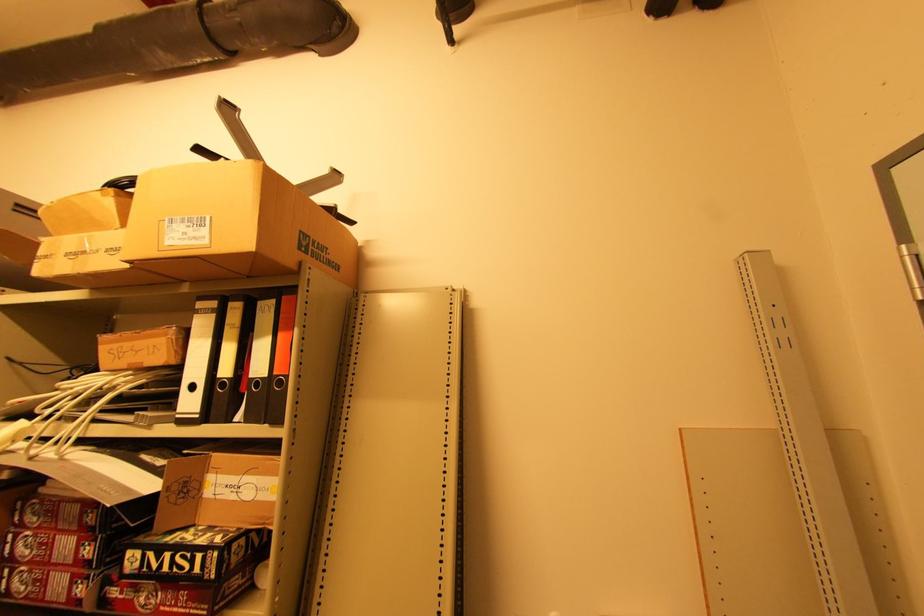
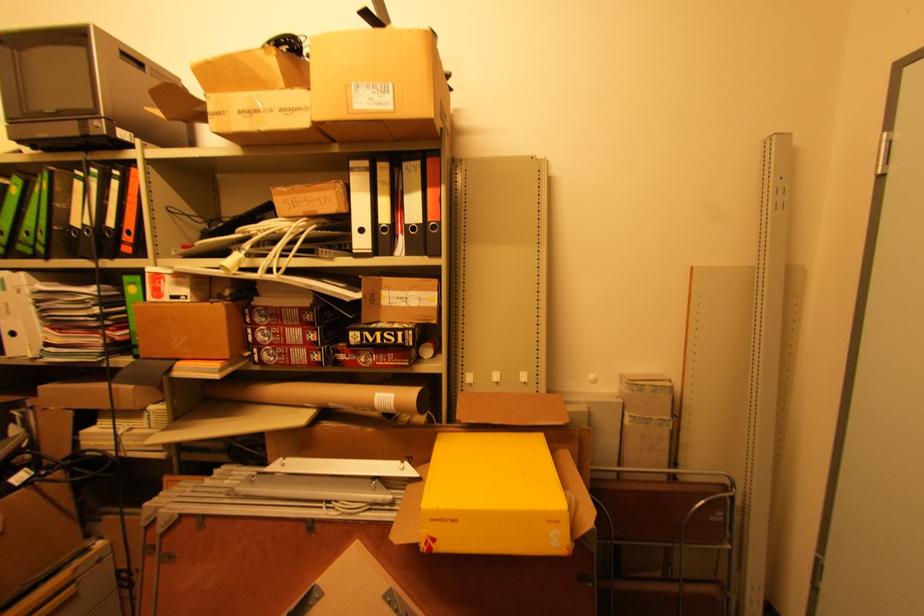
In the second image, find the point that corresponds to point 196,387 in the first image.

(365, 231)